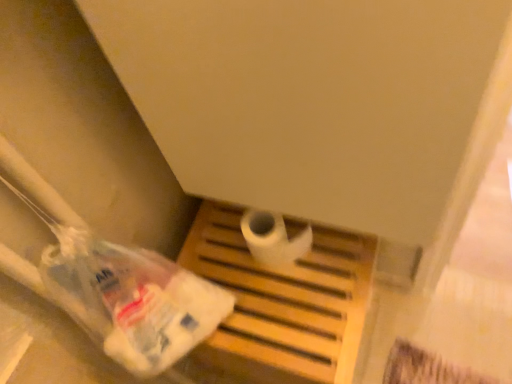
Question: Is white matte toilet paper at center in front of translucent plastic bag at lower left?

Choices:
 (A) yes
 (B) no

Answer: (B)

Question: Is white matte toilet paper at center not inside translucent plastic bag at lower left?

Choices:
 (A) yes
 (B) no

Answer: (A)

Question: Is white matte toilet paper at center positioned behind translucent plastic bag at lower left?

Choices:
 (A) no
 (B) yes

Answer: (B)

Question: Can you confirm if white matte toilet paper at center is thinner than translucent plastic bag at lower left?

Choices:
 (A) no
 (B) yes

Answer: (B)

Question: Can you confirm if white matte toilet paper at center is wider than translucent plastic bag at lower left?

Choices:
 (A) yes
 (B) no

Answer: (B)

Question: From the image's perspective, is white matte toilet paper at center located above or below translucent plastic bag at lower left?

Choices:
 (A) above
 (B) below

Answer: (A)

Question: Is point (273, 261) closer or farther from the camera than point (64, 274)?

Choices:
 (A) closer
 (B) farther

Answer: (B)

Question: Is white matte toilet paper at center bigger or smaller than translucent plastic bag at lower left?

Choices:
 (A) big
 (B) small

Answer: (B)

Question: From their relative heights in the image, would you say white matte toilet paper at center is taller or shorter than translucent plastic bag at lower left?

Choices:
 (A) short
 (B) tall

Answer: (A)

Question: Considering the relative positions of translucent plastic bag at lower left and white matte toilet paper at center in the image provided, is translucent plastic bag at lower left to the left or to the right of white matte toilet paper at center?

Choices:
 (A) right
 (B) left

Answer: (B)

Question: Is translucent plastic bag at lower left wider or thinner than white matte toilet paper at center?

Choices:
 (A) thin
 (B) wide

Answer: (B)

Question: From a real-world perspective, is translucent plastic bag at lower left above or below white matte toilet paper at center?

Choices:
 (A) below
 (B) above

Answer: (B)

Question: Is point (68, 284) closer or farther from the camera than point (262, 231)?

Choices:
 (A) closer
 (B) farther

Answer: (A)

Question: Is point (276, 248) positioned closer to the camera than point (355, 281)?

Choices:
 (A) farther
 (B) closer

Answer: (A)

Question: Considering the positions of white matte toilet paper at center and wooden tray at center in the image, is white matte toilet paper at center wider or thinner than wooden tray at center?

Choices:
 (A) thin
 (B) wide

Answer: (A)